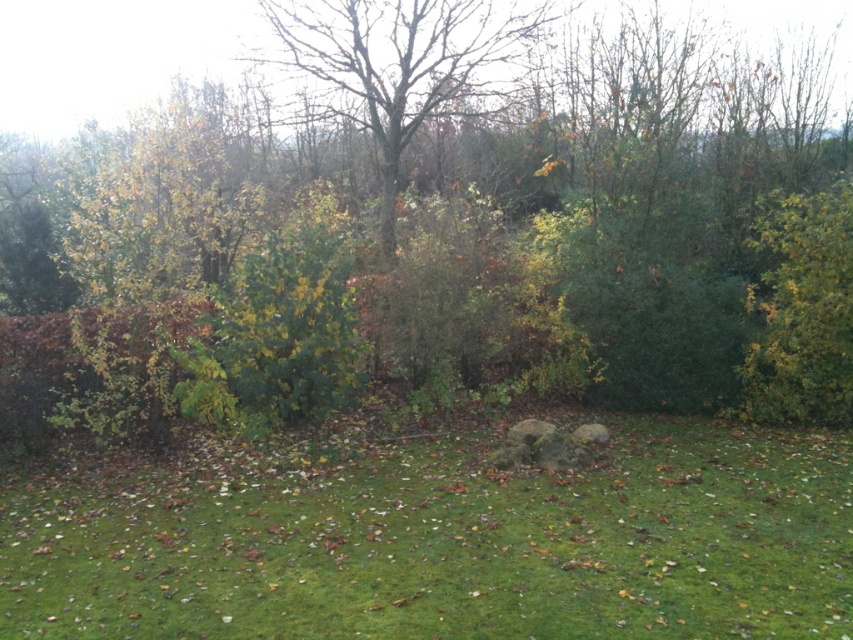
Question: Does green grassy area at center have a greater width compared to green leafy bush at center?

Choices:
 (A) yes
 (B) no

Answer: (A)

Question: Does green leafy tree at center appear under green leafy bush at center?

Choices:
 (A) yes
 (B) no

Answer: (B)

Question: Which point is closer to the camera?

Choices:
 (A) (163, 170)
 (B) (490, 564)
 (C) (347, 301)

Answer: (B)

Question: Can you confirm if green leafy tree at center is positioned below bare wood tree at center?

Choices:
 (A) no
 (B) yes

Answer: (B)

Question: Estimate the real-world distances between objects in this image. Which object is closer to the bare wood tree at center?

Choices:
 (A) green leafy bush at center
 (B) green leafy tree at center
 (C) green grassy area at center

Answer: (B)

Question: Which is nearer to the bare wood tree at center?

Choices:
 (A) green leafy bush at center
 (B) green grassy area at center

Answer: (A)